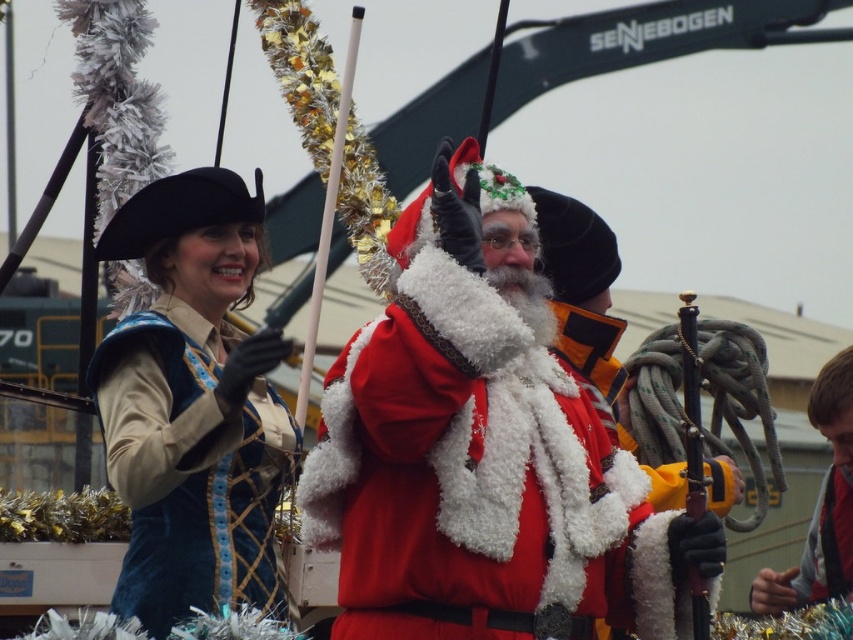
Which is more to the right, fuzzy red santa at center or velvet blue dress at left?

From the viewer's perspective, fuzzy red santa at center appears more on the right side.

Which is in front, point (469, 177) or point (236, 580)?

Positioned in front is point (469, 177).

Find the location of a particular element. fuzzy red santa at center is located at coordinates (483, 451).

Does velvet blue dress at left appear on the right side of red fabric jacket at lower right?

Incorrect, velvet blue dress at left is not on the right side of red fabric jacket at lower right.

Is point (218, 378) farther from viewer compared to point (785, 611)?

No, it is not.

Is point (283, 339) positioned after point (824, 497)?

No.

In order to click on velvet blue dress at left in this screenshot , I will do `click(193, 404)`.

Is fuzzy red santa at center above red fabric jacket at lower right?

Indeed, fuzzy red santa at center is positioned over red fabric jacket at lower right.

Can you confirm if fuzzy red santa at center is thinner than red fabric jacket at lower right?

In fact, fuzzy red santa at center might be wider than red fabric jacket at lower right.

Which is behind, point (428, 484) or point (822, 595)?

Positioned behind is point (822, 595).

This screenshot has width=853, height=640. In order to click on fuzzy red santa at center in this screenshot , I will do pos(483,451).